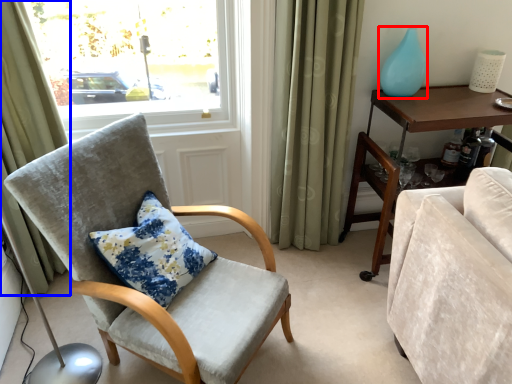
Question: Among these objects, which one is nearest to the camera, glass vase (highlighted by a red box) or curtain (highlighted by a blue box)?

Choices:
 (A) glass vase
 (B) curtain

Answer: (B)